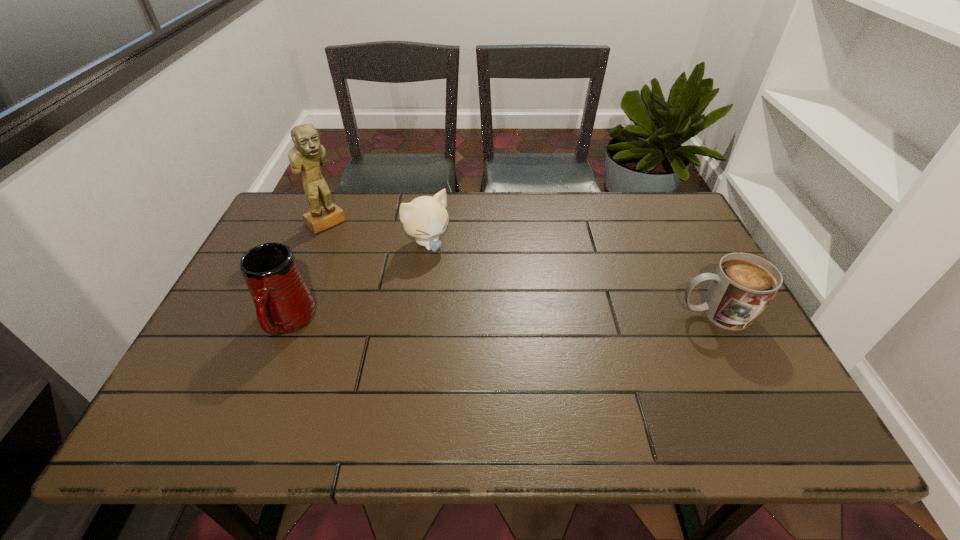
Find the location of a particular element. The width and height of the screenshot is (960, 540). vacant space that is in between the left mug and the tallest object is located at coordinates [307, 272].

Where is `vacant area that lies between the kitten and the taller mug`? vacant area that lies between the kitten and the taller mug is located at coordinates (358, 283).

Where is `empty location between the shorter mug and the taller mug`? empty location between the shorter mug and the taller mug is located at coordinates [x=501, y=318].

The height and width of the screenshot is (540, 960). What are the coordinates of `empty space between the tallest object and the left mug` in the screenshot? It's located at (307, 272).

You are a GUI agent. You are given a task and a screenshot of the screen. Output one action in this format:
    pyautogui.click(x=<x>, y=<y>)
    Task: Click on the unoccupied position between the left mug and the right mug
    The image size is (960, 540).
    Given the screenshot: What is the action you would take?
    pyautogui.click(x=501, y=318)

I want to click on vacant area that lies between the third object from left to right and the taller mug, so click(x=358, y=283).

The height and width of the screenshot is (540, 960). Find the location of `vacant area that lies between the taller mug and the tallest object`. vacant area that lies between the taller mug and the tallest object is located at coordinates (307, 272).

The image size is (960, 540). I want to click on the second closest object to the kitten, so click(x=284, y=303).

The image size is (960, 540). What are the coordinates of `object that can be found as the third closest to the third object from left to right` in the screenshot? It's located at (742, 286).

At what (x,y) coordinates should I click in order to perform the action: click on vacant position in the image that satisfies the following two spatial constraints: 1. on the front side of the kitten; 2. on the side of the rightmost object with the handle. Please return your answer as a coordinate pair (x, y). This screenshot has height=540, width=960. Looking at the image, I should click on (419, 314).